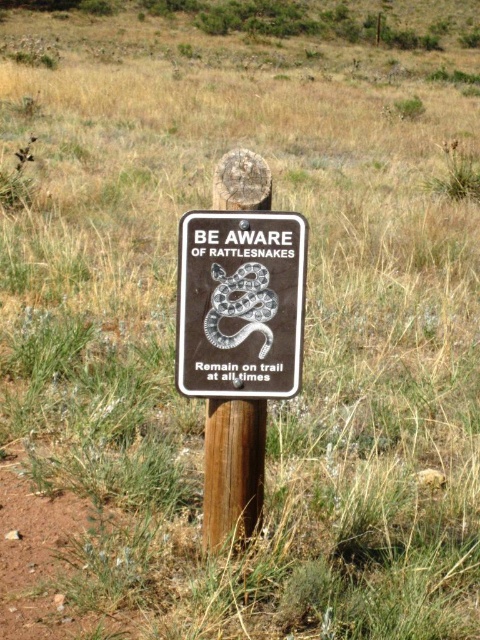
Question: Is black matte sign at center closer to camera compared to brown wood post at center?

Choices:
 (A) no
 (B) yes

Answer: (B)

Question: Which of the following is the closest to the observer?

Choices:
 (A) brown wood post at center
 (B) black matte sign at center

Answer: (B)

Question: Can you confirm if black matte sign at center is smaller than brown wood post at center?

Choices:
 (A) no
 (B) yes

Answer: (B)

Question: Which object is farther from the camera taking this photo?

Choices:
 (A) brown wood post at center
 (B) black matte sign at center

Answer: (A)

Question: Which point is closer to the camera taking this photo?

Choices:
 (A) (268, 282)
 (B) (228, 444)

Answer: (A)

Question: Is the position of black matte sign at center less distant than that of brown wood post at center?

Choices:
 (A) no
 (B) yes

Answer: (B)